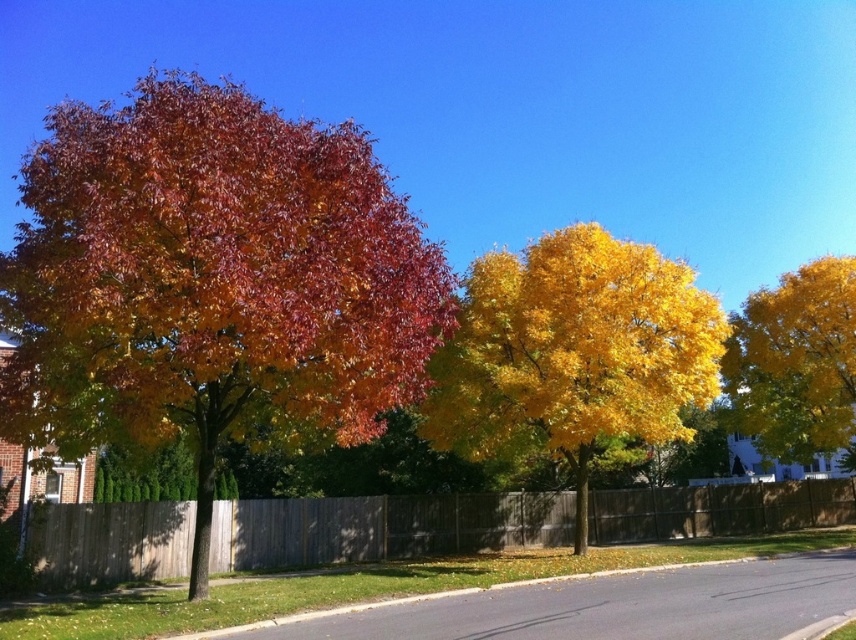
Does golden yellow leaves at center have a larger size compared to wooden fence at center?

No, golden yellow leaves at center is not bigger than wooden fence at center.

In the scene shown: Between golden yellow leaves at center and wooden fence at center, which one has less height?

Standing shorter between the two is wooden fence at center.

Which is in front, point (682, 308) or point (642, 532)?

Point (682, 308) is in front.

At what (x,y) coordinates should I click in order to perform the action: click on golden yellow leaves at center. Please return your answer as a coordinate pair (x, y). Looking at the image, I should click on (574, 353).

In the scene shown: Which is more to the right, multicolored foliage at left or yellow glossy tree at right?

From the viewer's perspective, yellow glossy tree at right appears more on the right side.

Does multicolored foliage at left have a greater height compared to yellow glossy tree at right?

Yes.

Who is more distant from viewer, (176,188) or (834,442)?

Positioned behind is point (834,442).

Identify the location of multicolored foliage at left. (212, 282).

Consider the image. Does golden yellow leaves at center have a smaller size compared to yellow glossy tree at right?

No, golden yellow leaves at center is not smaller than yellow glossy tree at right.

Which is above, golden yellow leaves at center or yellow glossy tree at right?

yellow glossy tree at right is above.

The image size is (856, 640). I want to click on golden yellow leaves at center, so click(x=574, y=353).